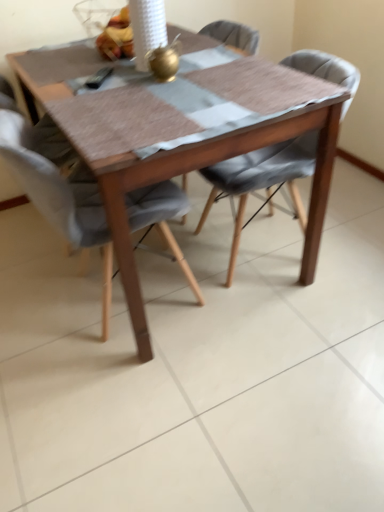
Question: Is wooden table at center taller or shorter than light gray fabric chair at center, marked as the second chair in a right-to-left arrangement?

Choices:
 (A) tall
 (B) short

Answer: (B)

Question: From the image's perspective, is wooden table at center above or below light gray fabric chair at center, marked as the second chair in a right-to-left arrangement?

Choices:
 (A) below
 (B) above

Answer: (B)

Question: Which object is the farthest from the wooden table at center?

Choices:
 (A) shiny plastic bag of fruits at upper center
 (B) light gray fabric chair at center, marked as the second chair in a right-to-left arrangement
 (C) textured gray cushioned chair at center, the 1th chair positioned from the right

Answer: (A)

Question: Which object is positioned closest to the textured gray cushioned chair at center, the 1th chair positioned from the right?

Choices:
 (A) wooden table at center
 (B) shiny plastic bag of fruits at upper center
 (C) light gray fabric chair at center, marked as the second chair in a right-to-left arrangement

Answer: (A)